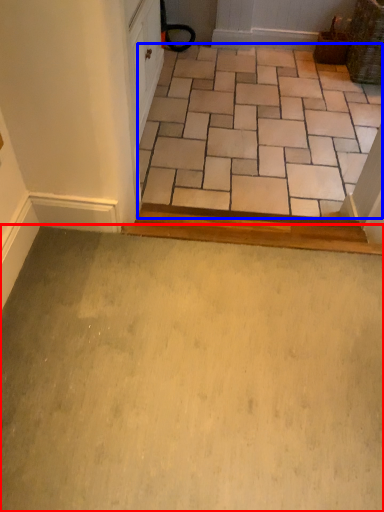
Question: Among these objects, which one is nearest to the camera, path (highlighted by a red box) or ceramic tile (highlighted by a blue box)?

Choices:
 (A) path
 (B) ceramic tile

Answer: (A)